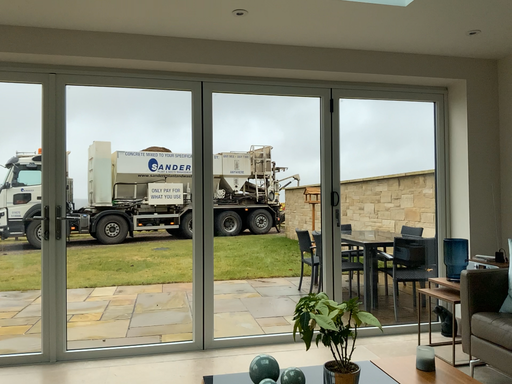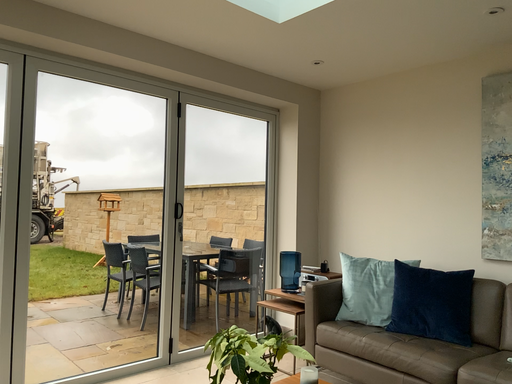
Question: Which way did the camera rotate in the video?

Choices:
 (A) rotated left
 (B) rotated right

Answer: (B)